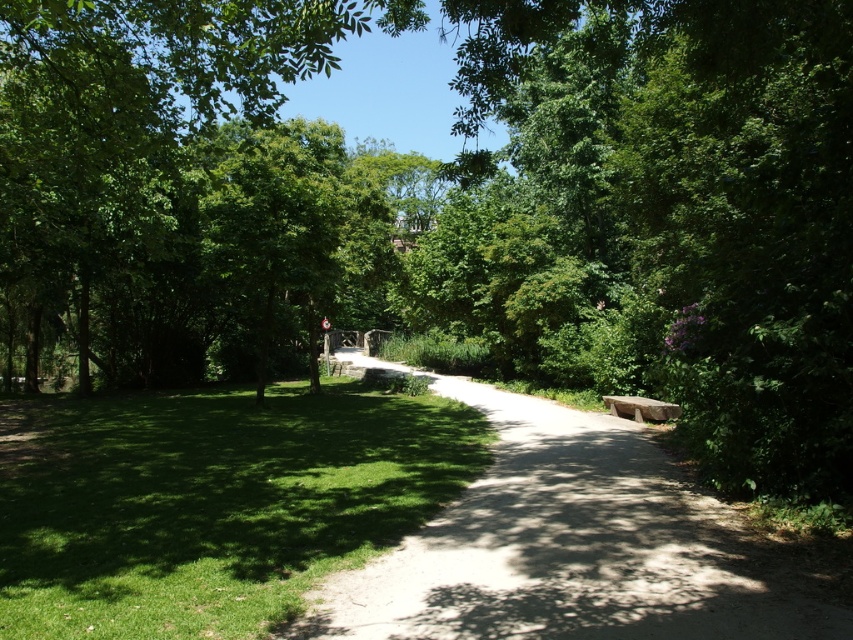
Between point (35, 538) and point (630, 483), which one is positioned in front?

Point (35, 538)

Is green grass at center taller than dirt path at center?

Yes, green grass at center is taller than dirt path at center.

Find the location of `green grass at center`. green grass at center is located at coordinates (212, 500).

Can you confirm if dirt path at center is positioned above gray stone bench at right?

No.

Does dirt path at center come in front of gray stone bench at right?

Yes, it is in front of gray stone bench at right.

Which is behind, point (549, 522) or point (631, 412)?

Positioned behind is point (631, 412).

Locate an element on the screen. dirt path at center is located at coordinates (570, 545).

Is the position of green grass at center more distant than that of gray stone bench at right?

No, green grass at center is closer to the viewer.

Which is more to the right, green grass at center or gray stone bench at right?

gray stone bench at right

Measure the distance between point (61, 570) and camera.

Point (61, 570) and camera are 6.83 meters apart.

This screenshot has width=853, height=640. What are the coordinates of `green grass at center` in the screenshot? It's located at (212, 500).